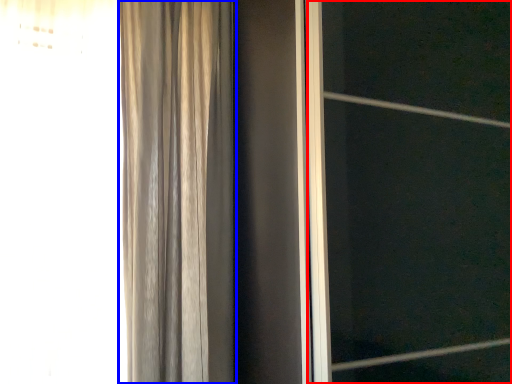
Question: Which object appears farthest to the camera in this image, screen door (highlighted by a red box) or curtain (highlighted by a blue box)?

Choices:
 (A) screen door
 (B) curtain

Answer: (B)